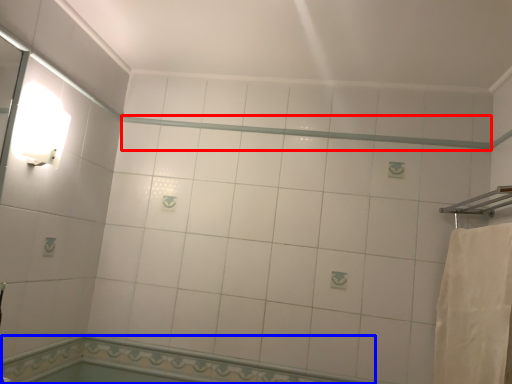
Question: Which object is closer to the camera taking this photo, beam (highlighted by a red box) or bath (highlighted by a blue box)?

Choices:
 (A) beam
 (B) bath

Answer: (B)